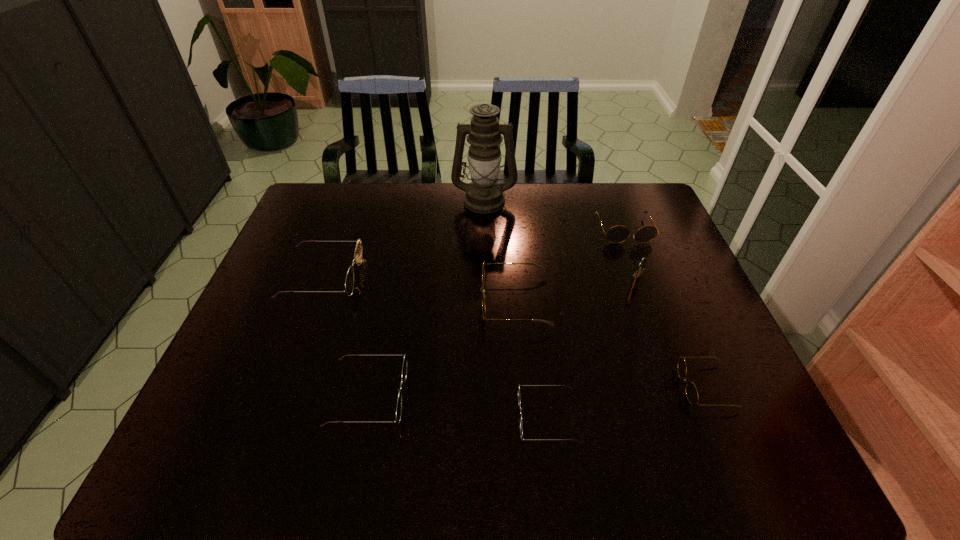
Locate an element on the screen. The height and width of the screenshot is (540, 960). the second green sunglasses from right to left is located at coordinates [404, 368].

I want to click on the smallest gray sunglasses, so click(691, 391).

You are a GUI agent. You are given a task and a screenshot of the screen. Output one action in this format:
    pyautogui.click(x=<x>, y=<y>)
    Task: Click on the shortest object
    This screenshot has width=960, height=540.
    Given the screenshot: What is the action you would take?
    pyautogui.click(x=519, y=401)

Find the location of `the smallest green sunglasses`. the smallest green sunglasses is located at coordinates (519, 401).

At what (x,y) coordinates should I click in order to perform the action: click on free space located 0.200m on the front of the farthest object. Please return your answer as a coordinate pair (x, y). The width and height of the screenshot is (960, 540). Looking at the image, I should click on (485, 253).

Where is `vacant space located on the right of the padlock`? Image resolution: width=960 pixels, height=540 pixels. vacant space located on the right of the padlock is located at coordinates (696, 285).

In order to click on vacant space situated 0.090m on the lenses of the leftmost gray sunglasses in this screenshot , I will do `click(447, 301)`.

Locate an element on the screen. This screenshot has width=960, height=540. blank space located on the lenses of the leftmost gray sunglasses is located at coordinates (450, 301).

This screenshot has height=540, width=960. In order to click on vacant space located on the lenses of the leftmost gray sunglasses in this screenshot , I will do `click(376, 301)`.

At what (x,y) coordinates should I click in order to perform the action: click on free space located 0.270m on the front-facing side of the leftmost sunglasses. Please return your answer as a coordinate pair (x, y). The image size is (960, 540). Looking at the image, I should click on (453, 276).